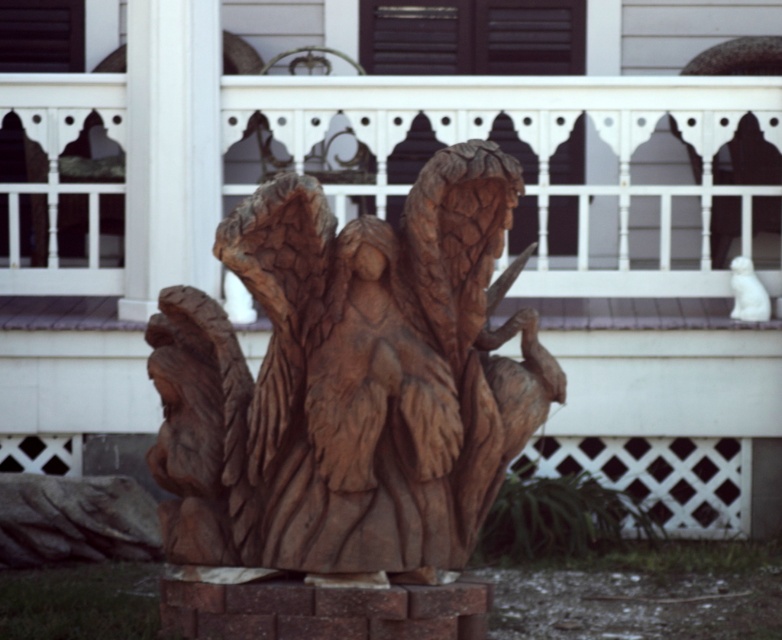
Question: Which point is closer to the camera?

Choices:
 (A) brown wood carving at center
 (B) white wood railing at center

Answer: (A)

Question: Considering the relative positions of white wood railing at center and brown wood carving at center in the image provided, where is white wood railing at center located with respect to brown wood carving at center?

Choices:
 (A) above
 (B) below

Answer: (A)

Question: Which object appears farthest from the camera in this image?

Choices:
 (A) brown wood carving at center
 (B) white wood railing at center

Answer: (B)

Question: Can you confirm if white wood railing at center is bigger than brown wood carving at center?

Choices:
 (A) yes
 (B) no

Answer: (A)

Question: Does white wood railing at center have a smaller size compared to brown wood carving at center?

Choices:
 (A) yes
 (B) no

Answer: (B)